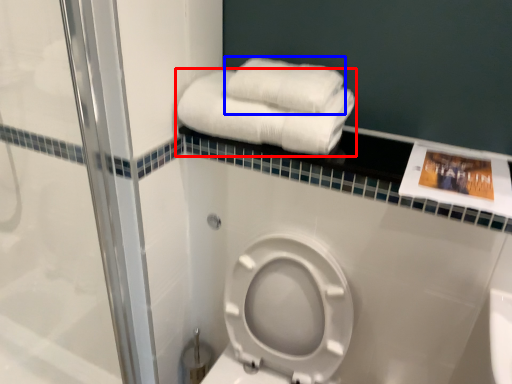
Question: Which object is further to the camera taking this photo, towel (highlighted by a red box) or towel (highlighted by a blue box)?

Choices:
 (A) towel
 (B) towel

Answer: (B)